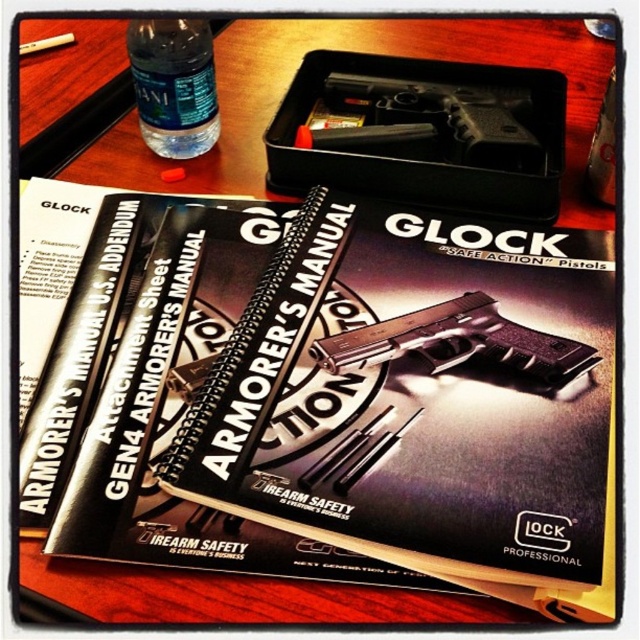
Question: Can you confirm if black plastic handgun at center is bigger than clear plastic bottle at upper left?

Choices:
 (A) yes
 (B) no

Answer: (A)

Question: From the image, what is the correct spatial relationship of matte black manual at center in relation to matte black handgun at center?

Choices:
 (A) above
 (B) below

Answer: (A)

Question: Among these objects, which one is farthest from the camera?

Choices:
 (A) clear plastic bottle at upper left
 (B) matte black handgun at center
 (C) black plastic handgun at center

Answer: (A)

Question: Which of these objects is positioned closest to the clear plastic bottle at upper left?

Choices:
 (A) black plastic handgun at center
 (B) matte black handgun at center

Answer: (A)

Question: Is matte black manual at center thinner than black plastic handgun at center?

Choices:
 (A) no
 (B) yes

Answer: (A)

Question: Estimate the real-world distances between objects in this image. Which object is farther from the black plastic handgun at center?

Choices:
 (A) matte black handgun at center
 (B) matte black manual at center

Answer: (A)